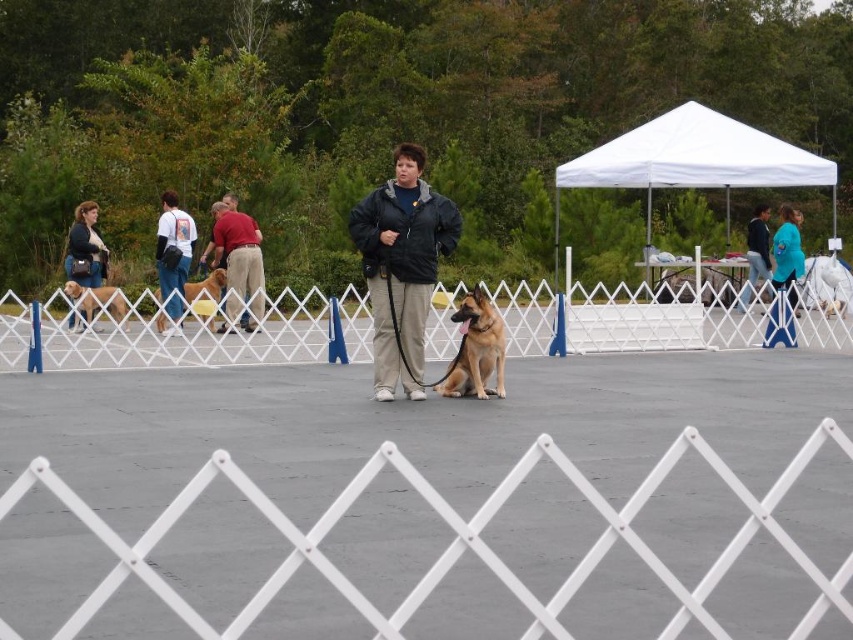
Question: Is white metal fence at center positioned at the back of blue fabric shirt at upper right?

Choices:
 (A) no
 (B) yes

Answer: (A)

Question: Among these points, which one is nearest to the camera?

Choices:
 (A) (750, 282)
 (B) (114, 310)
 (C) (848, 616)
 (D) (239, 310)

Answer: (C)

Question: Is red shirt at center positioned behind blue fabric shirt at upper right?

Choices:
 (A) yes
 (B) no

Answer: (B)

Question: Is white fabric canopy at upper center to the left of black matte jacket at center from the viewer's perspective?

Choices:
 (A) yes
 (B) no

Answer: (B)

Question: Which object is farther from the camera taking this photo?

Choices:
 (A) golden brown fur at center
 (B) white fabric canopy at upper center
 (C) white t-shirt at left
 (D) white metal fence at center

Answer: (B)

Question: Estimate the real-world distances between objects in this image. Which object is closer to the matte black jacket at upper left?

Choices:
 (A) white plastic fence at center
 (B) golden brown fur at center
 (C) red shirt at center

Answer: (B)